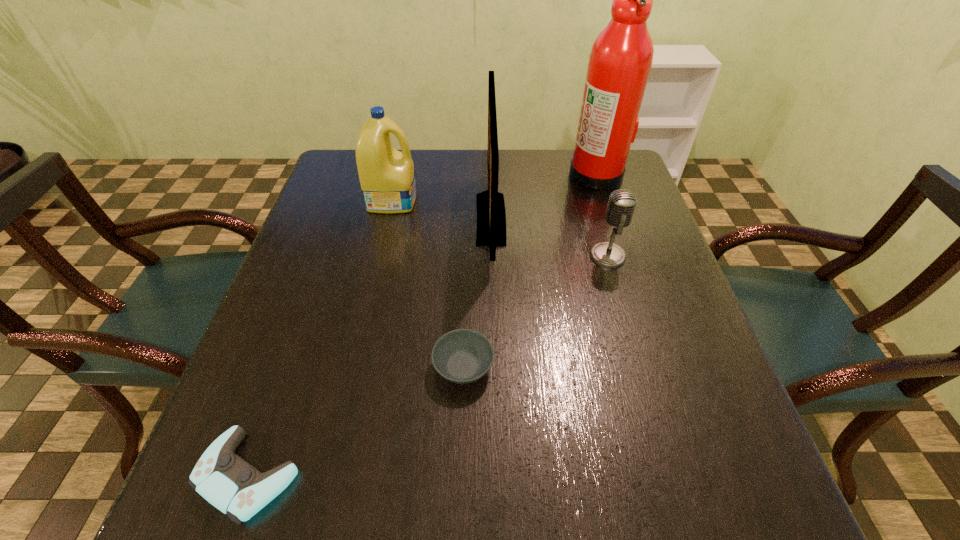
You are a GUI agent. You are given a task and a screenshot of the screen. Output one action in this format:
    pyautogui.click(x=<x>, y=<y>)
    Task: Click on the vacant region at the right edge
    The height and width of the screenshot is (540, 960).
    Given the screenshot: What is the action you would take?
    pyautogui.click(x=674, y=377)

The width and height of the screenshot is (960, 540). I want to click on free space between the monitor and the second nearest object, so click(477, 293).

Locate an element on the screen. Image resolution: width=960 pixels, height=540 pixels. vacant space that is in between the monitor and the fourth shortest object is located at coordinates (442, 209).

What are the coordinates of `vacant space in between the monitor and the fire extinguisher` in the screenshot? It's located at (543, 197).

The image size is (960, 540). Find the location of `free space between the fifth farthest object and the microphone`. free space between the fifth farthest object and the microphone is located at coordinates (536, 312).

Image resolution: width=960 pixels, height=540 pixels. In order to click on vacant space in between the monitor and the microphone in this screenshot , I will do `click(549, 238)`.

Locate an element on the screen. The image size is (960, 540). vacant space in between the tallest object and the nearest object is located at coordinates (422, 325).

You are a GUI agent. You are given a task and a screenshot of the screen. Output one action in this format:
    pyautogui.click(x=<x>, y=<y>)
    Task: Click on the free spot between the monitor and the control
    This screenshot has width=960, height=540.
    Given the screenshot: What is the action you would take?
    pyautogui.click(x=370, y=347)

In order to click on free spot between the monitor and the detergent in this screenshot , I will do `click(442, 209)`.

Where is `object that is the third closest to the fourth tallest object`? object that is the third closest to the fourth tallest object is located at coordinates (462, 356).